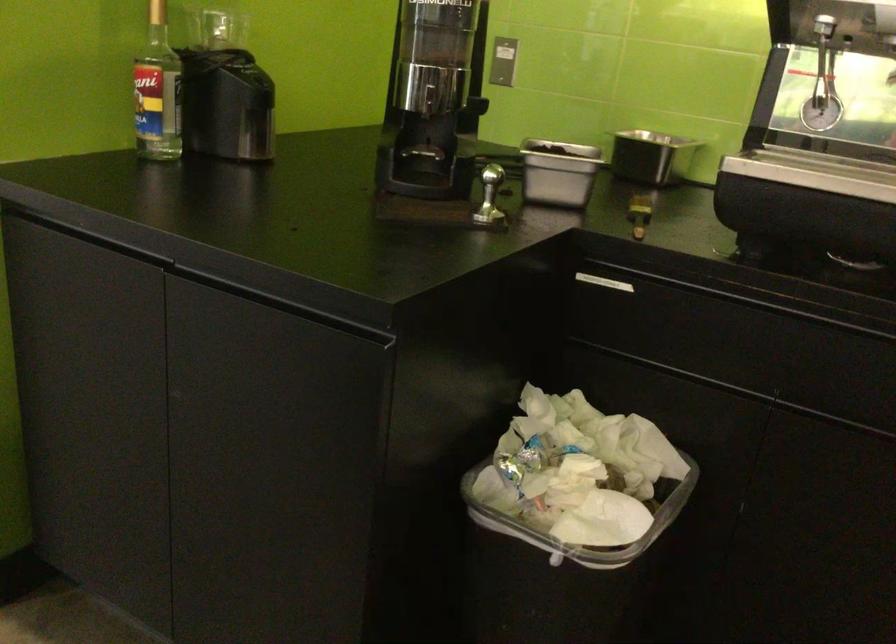
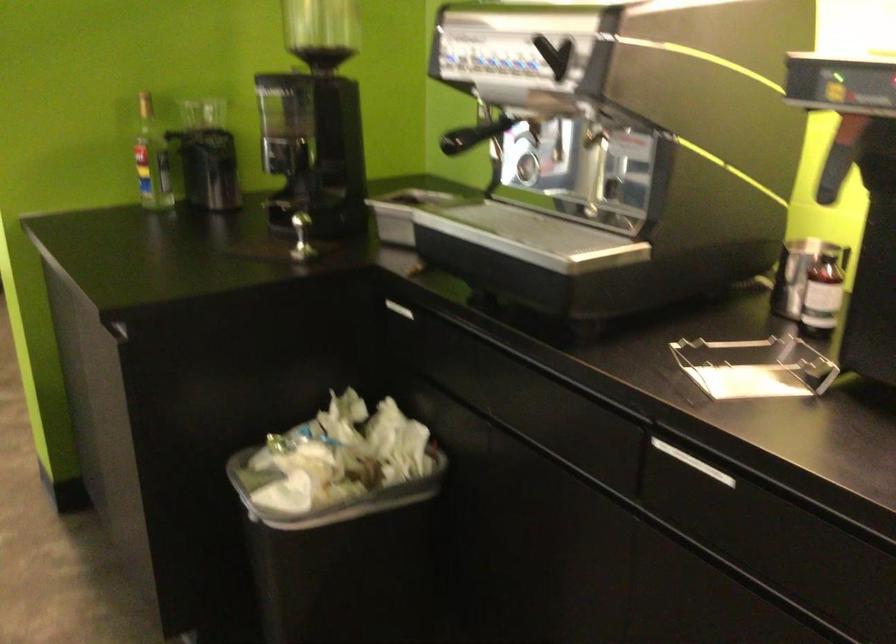
The point at (590,281) is marked in the first image. Where is the corresponding point in the second image?

(394, 308)